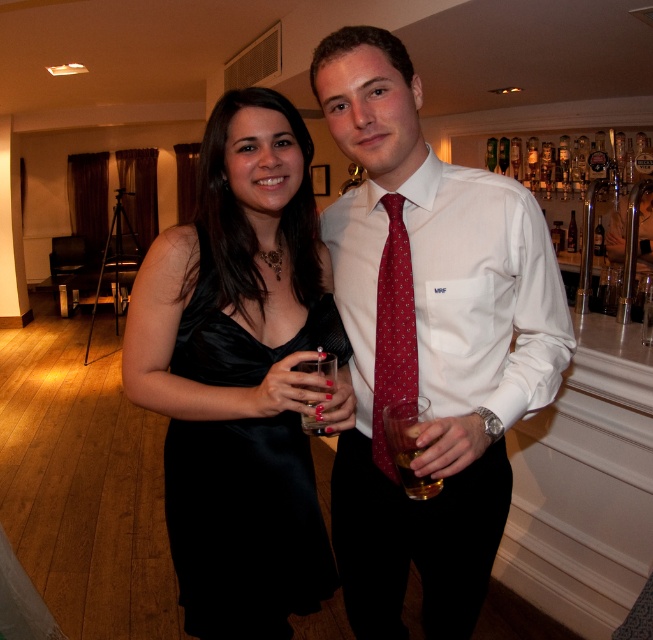
Question: Is satin black dress at center above red dotted tie at center?

Choices:
 (A) no
 (B) yes

Answer: (A)

Question: Does white silk shirt at center appear under translucent amber liquid at center?

Choices:
 (A) yes
 (B) no

Answer: (B)

Question: Among these points, which one is nearest to the camera?

Choices:
 (A) (317, 358)
 (B) (411, 449)

Answer: (B)

Question: Which point is closer to the camera?

Choices:
 (A) red dotted tie at center
 (B) clear plastic cup at center

Answer: (B)

Question: Which object is positioned closest to the translucent amber liquid at center?

Choices:
 (A) white silk shirt at center
 (B) clear plastic cup at center
 (C) translucent glass at lower center
 (D) satin black dress at center

Answer: (C)

Question: Can you confirm if satin black dress at center is bigger than clear plastic cup at center?

Choices:
 (A) no
 (B) yes

Answer: (B)